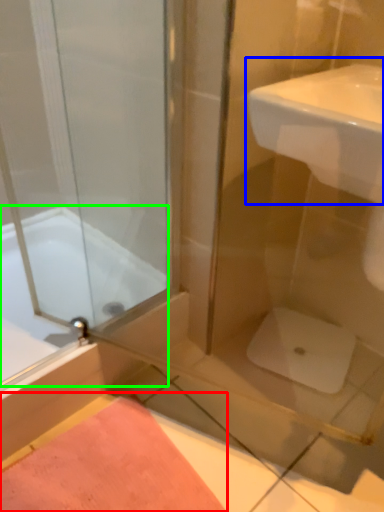
Question: Estimate the real-world distances between objects in this image. Which object is closer to bath mat (highlighted by a red box), sink (highlighted by a blue box) or bathtub (highlighted by a green box)?

Choices:
 (A) sink
 (B) bathtub

Answer: (B)